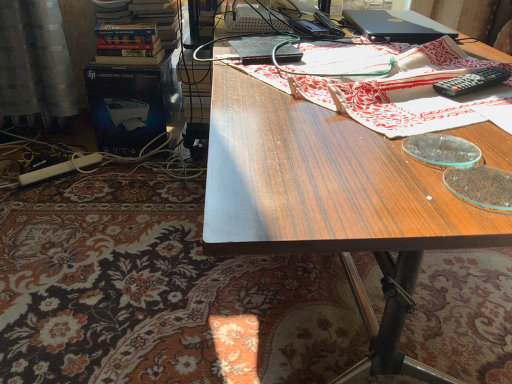
Question: Are black plastic remote control at upper right and satin curtain at left far apart?

Choices:
 (A) no
 (B) yes

Answer: (B)

Question: Does black plastic remote control at upper right have a smaller size compared to satin curtain at left?

Choices:
 (A) yes
 (B) no

Answer: (A)

Question: Can you confirm if black plastic remote control at upper right is taller than satin curtain at left?

Choices:
 (A) yes
 (B) no

Answer: (B)

Question: Does black plastic remote control at upper right lie behind satin curtain at left?

Choices:
 (A) yes
 (B) no

Answer: (B)

Question: From the image's perspective, is black plastic remote control at upper right located beneath satin curtain at left?

Choices:
 (A) yes
 (B) no

Answer: (A)

Question: In the image, is black plastic remote control at upper right positioned in front of or behind satin curtain at left?

Choices:
 (A) front
 (B) behind

Answer: (A)

Question: Is black plastic remote control at upper right inside the boundaries of satin curtain at left, or outside?

Choices:
 (A) outside
 (B) inside

Answer: (A)

Question: Considering the positions of black plastic remote control at upper right and satin curtain at left in the image, is black plastic remote control at upper right bigger or smaller than satin curtain at left?

Choices:
 (A) big
 (B) small

Answer: (B)

Question: From the image's perspective, is black plastic remote control at upper right positioned above or below satin curtain at left?

Choices:
 (A) above
 (B) below

Answer: (B)

Question: Is wooden desk at center to the left or to the right of hardcover books at upper left in the image?

Choices:
 (A) left
 (B) right

Answer: (B)

Question: Is wooden desk at center in front of or behind hardcover books at upper left in the image?

Choices:
 (A) behind
 (B) front

Answer: (B)

Question: From their relative heights in the image, would you say wooden desk at center is taller or shorter than hardcover books at upper left?

Choices:
 (A) short
 (B) tall

Answer: (B)

Question: Do you think wooden desk at center is within hardcover books at upper left, or outside of it?

Choices:
 (A) outside
 (B) inside

Answer: (A)

Question: Looking at the image, does black matte laptop at upper right seem bigger or smaller compared to wooden table at center?

Choices:
 (A) small
 (B) big

Answer: (A)

Question: From a real-world perspective, relative to wooden table at center, is black matte laptop at upper right vertically above or below?

Choices:
 (A) below
 (B) above

Answer: (B)